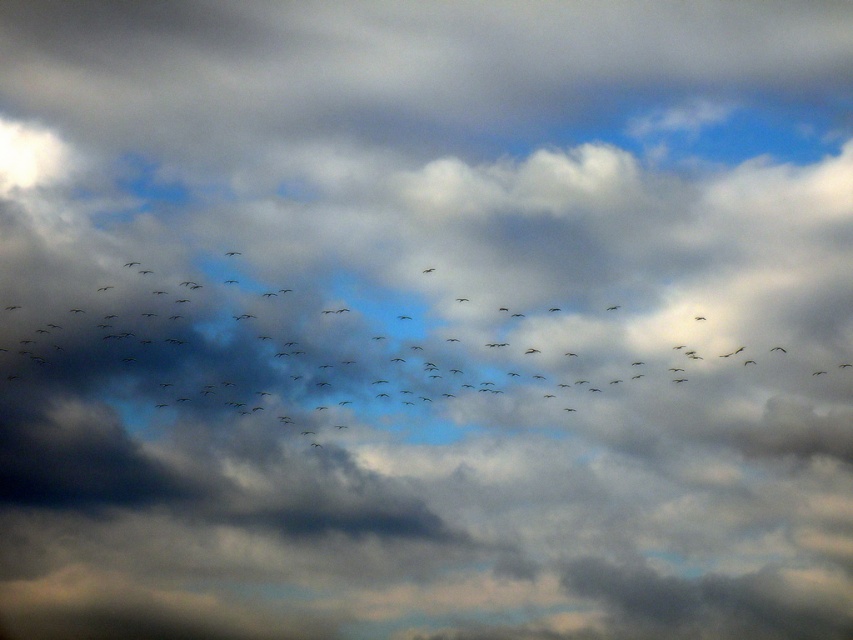
Question: Which of the following is the farthest from the observer?

Choices:
 (A) (450, 70)
 (B) (426, 269)

Answer: (A)

Question: Which point is farther to the camera?

Choices:
 (A) dark gray feathered bird at center
 (B) black matte birds at center

Answer: (A)

Question: Is black matte birds at center below dark gray feathered bird at center?

Choices:
 (A) yes
 (B) no

Answer: (A)

Question: Is black matte birds at center bigger than dark gray feathered bird at center?

Choices:
 (A) no
 (B) yes

Answer: (B)

Question: Where is black matte birds at center located in relation to dark gray feathered bird at center in the image?

Choices:
 (A) above
 (B) below

Answer: (B)